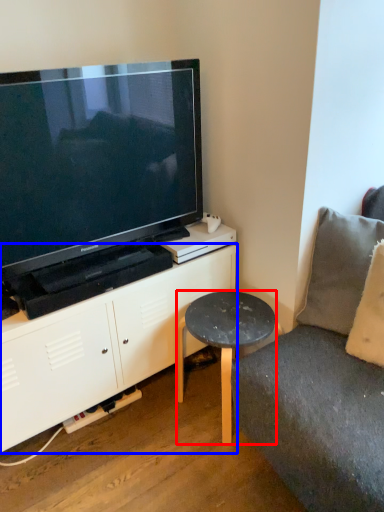
Question: Which of the following is the farthest to the observer, table (highlighted by a red box) or cabinetry (highlighted by a blue box)?

Choices:
 (A) table
 (B) cabinetry

Answer: (A)